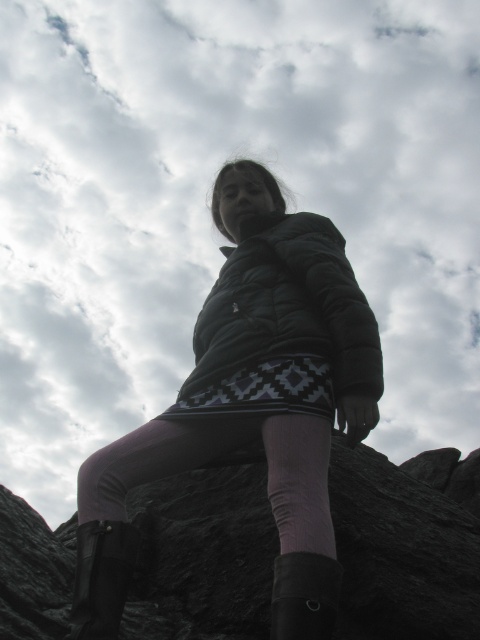
You are a photographer trying to capture a closeup of the black puffy jacket at center and the pink fabric sock at lower center. Given that your camera can only focus on objects within 20 inches of each other, will you need to adjust your position to ensure both are in focus?

The black puffy jacket at center is 22.24 inches away from the pink fabric sock at lower center, which exceeds the camera focus range of 20 inches. Therefore, you will need to adjust your position to ensure both are within the required distance for clear focus.

You are packing a backpack for a hiking trip and have limited space. You need to decide between bringing the matte black jacket at center or the black rubber boot at lower left. Based on their sizes, which item should you choose to maximize space efficiency?

The black rubber boot at lower left is smaller than the matte black jacket at center, so you should choose to bring the black rubber boot at lower left to save more space.

Based on the photo, you are a fashion designer observing the person in the image. You need to determine which item of clothing is higher on the person. Which is taller, the black puffy jacket at center or the pink fabric sock at lower center?

The black puffy jacket at center is taller than the pink fabric sock at lower center.